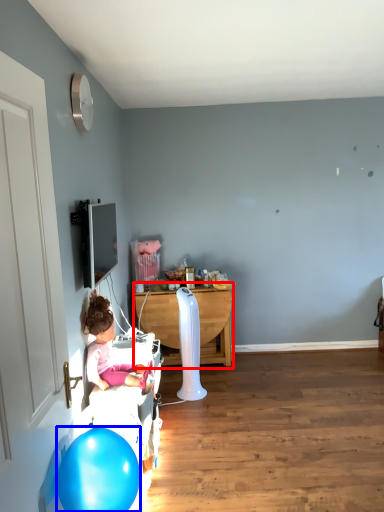
Question: Which point is further to the camera, table (highlighted by a red box) or balloon (highlighted by a blue box)?

Choices:
 (A) table
 (B) balloon

Answer: (A)